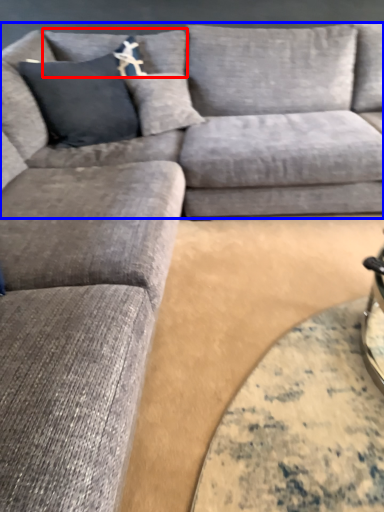
Question: Which object appears farthest to the camera in this image, pillow (highlighted by a red box) or couch (highlighted by a blue box)?

Choices:
 (A) pillow
 (B) couch

Answer: (A)